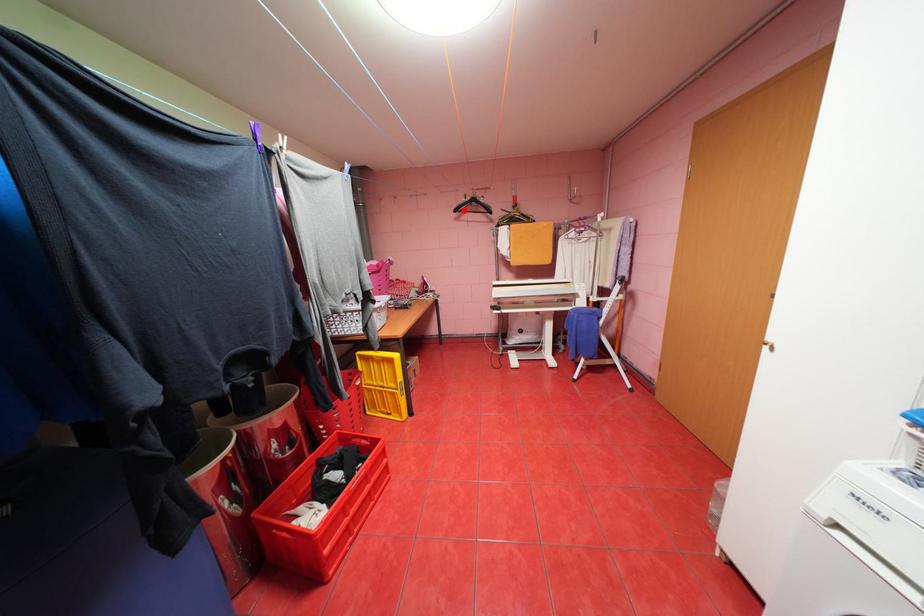
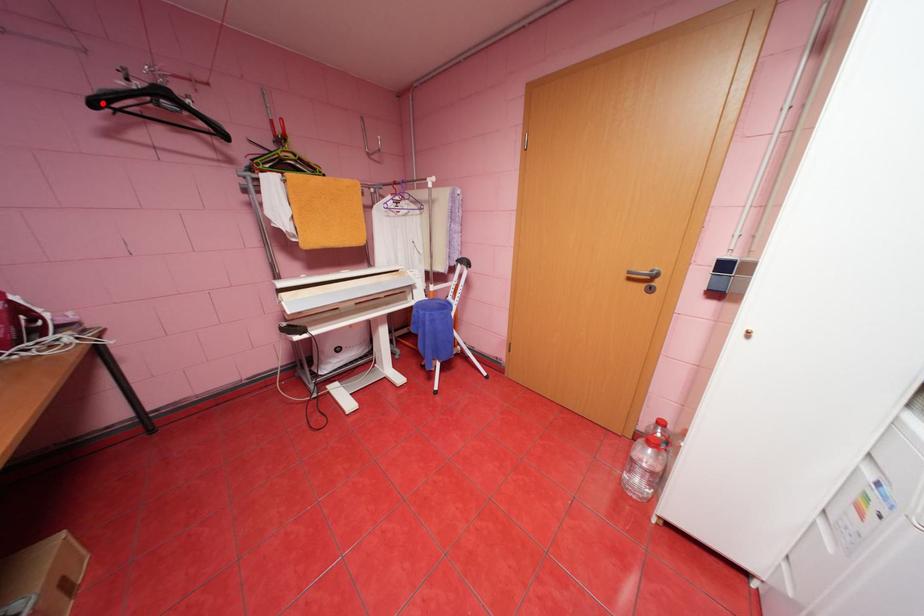
I am providing you with two images of the same scene from different viewpoints. A red point is marked on the first image and another point is marked on the second image. Is the marked point in image1 the same physical position as the marked point in image2?

Yes